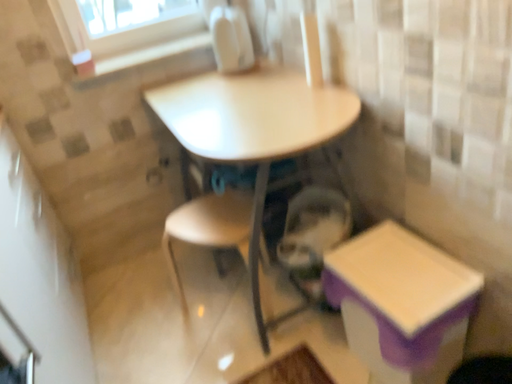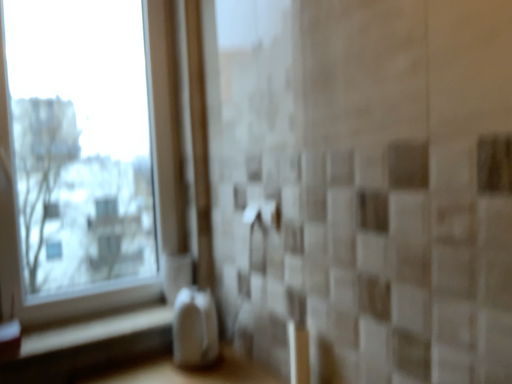
Question: How did the camera likely rotate when shooting the video?

Choices:
 (A) rotated left
 (B) rotated right

Answer: (B)